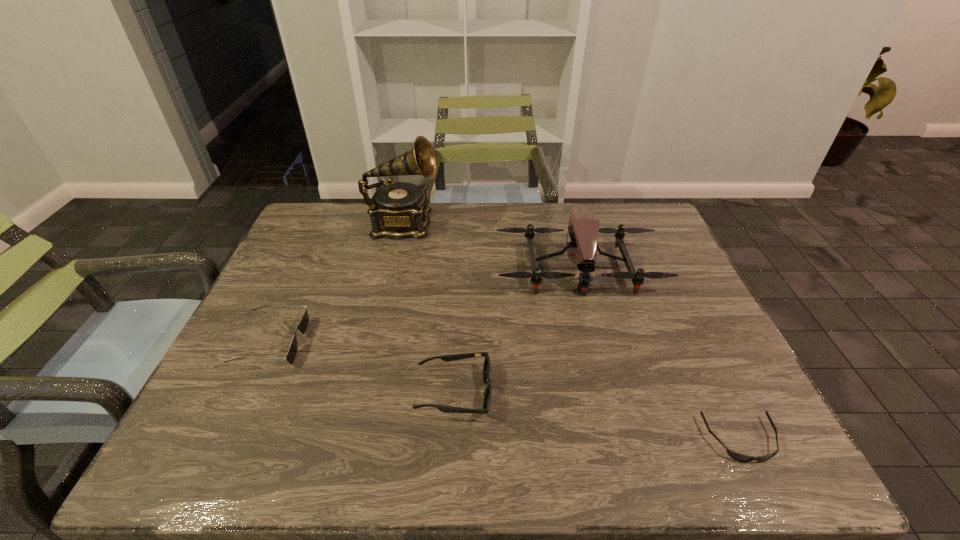
Identify the location of phonograph record that is at the far edge. (397, 210).

Identify the location of drone located at the far edge. [x=583, y=227].

This screenshot has width=960, height=540. I want to click on object located at the near edge, so click(x=739, y=457).

Where is `object at the left edge`? This screenshot has width=960, height=540. object at the left edge is located at coordinates (303, 325).

The height and width of the screenshot is (540, 960). What are the coordinates of `drone situated at the right edge` in the screenshot? It's located at (583, 227).

At what (x,y) coordinates should I click in order to perform the action: click on sunglasses that is at the right edge. Please return your answer as a coordinate pair (x, y). Looking at the image, I should click on (739, 457).

Locate an element on the screen. object that is at the far right corner is located at coordinates (583, 227).

The width and height of the screenshot is (960, 540). I want to click on object that is positioned at the near right corner, so click(739, 457).

Where is `vacant area at the far edge of the desktop`? This screenshot has width=960, height=540. vacant area at the far edge of the desktop is located at coordinates (601, 219).

Find the location of a particular element. Image resolution: width=960 pixels, height=540 pixels. vacant space at the near edge of the desktop is located at coordinates (483, 468).